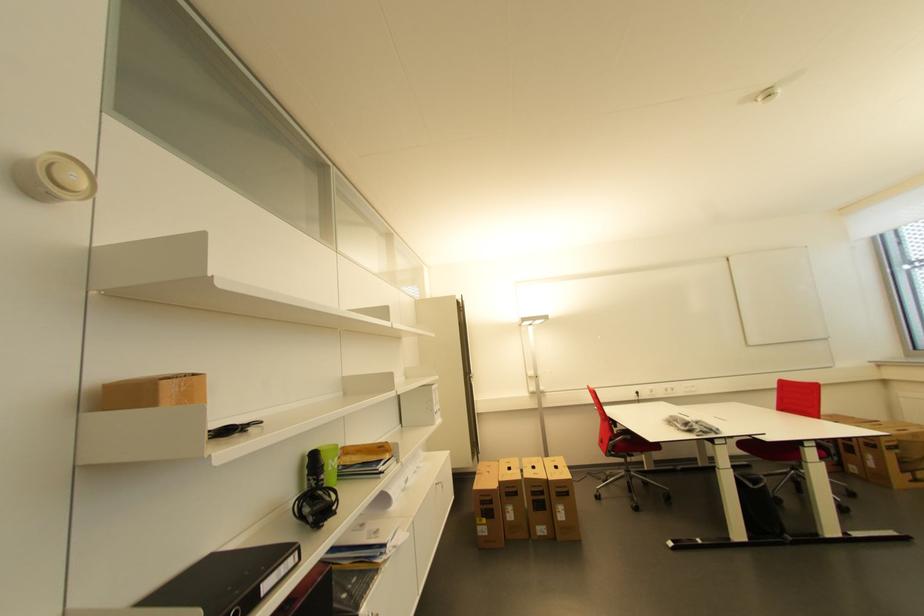
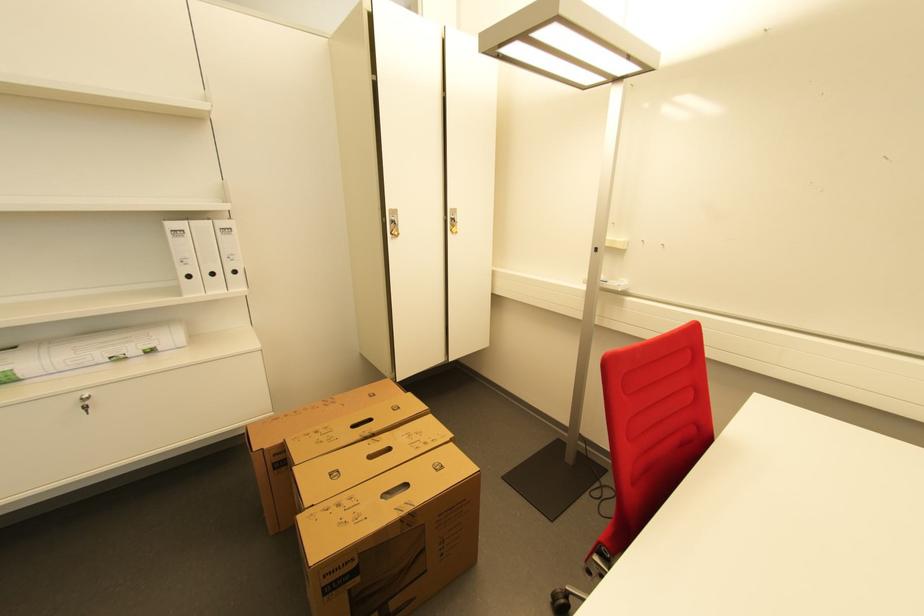
In the second image, find the point that corresponds to pixel 439 389 in the first image.

(176, 225)